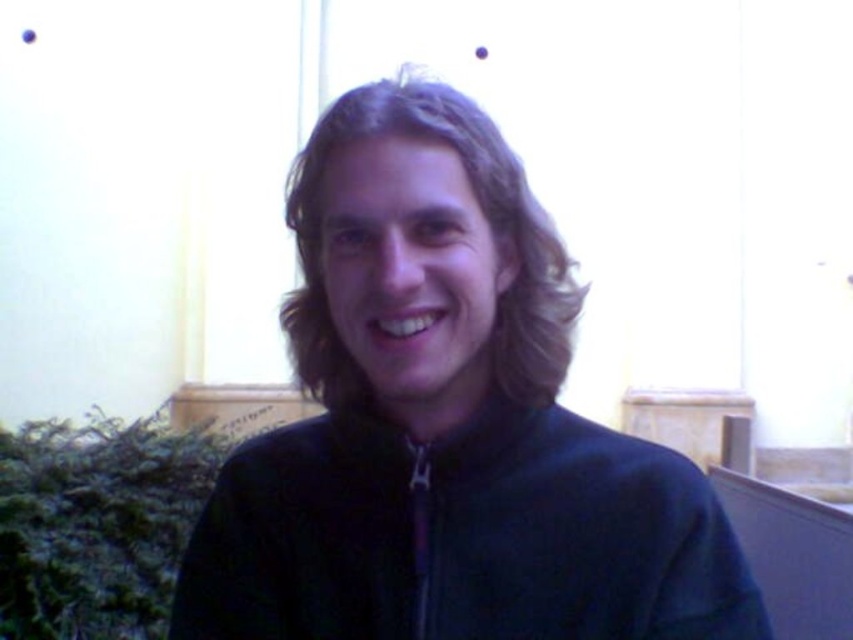
Does point (312, 376) come closer to viewer compared to point (560, 465)?

No, it is not.

This screenshot has height=640, width=853. What are the coordinates of `dark blue fleece at center` in the screenshot? It's located at (445, 422).

Does dark blue fleece jacket at center appear under dark brown wavy hair at center?

Indeed, dark blue fleece jacket at center is positioned under dark brown wavy hair at center.

Is dark blue fleece jacket at center wider than dark brown wavy hair at center?

Yes, dark blue fleece jacket at center is wider than dark brown wavy hair at center.

Between point (480, 588) and point (566, 330), which one is positioned behind?

The point (566, 330) is more distant.

Where is `dark blue fleece jacket at center`? dark blue fleece jacket at center is located at coordinates (462, 536).

From the picture: Between dark blue fleece at center and dark brown wavy hair at center, which one is positioned lower?

dark blue fleece at center is lower down.

Is dark blue fleece at center bigger than dark brown wavy hair at center?

Correct, dark blue fleece at center is larger in size than dark brown wavy hair at center.

Identify the location of dark blue fleece at center. Image resolution: width=853 pixels, height=640 pixels. (445, 422).

Identify the location of dark blue fleece at center. This screenshot has height=640, width=853. (445, 422).